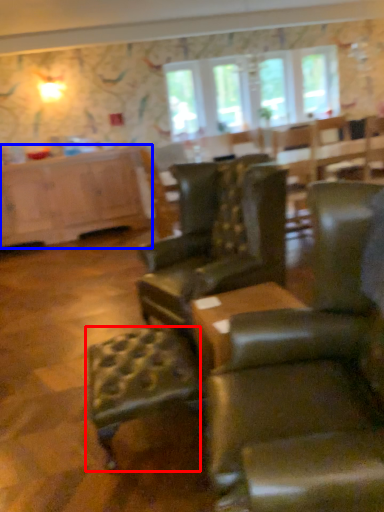
Question: Which point is closer to the camera, bar stool (highlighted by a red box) or cabinetry (highlighted by a blue box)?

Choices:
 (A) bar stool
 (B) cabinetry

Answer: (A)